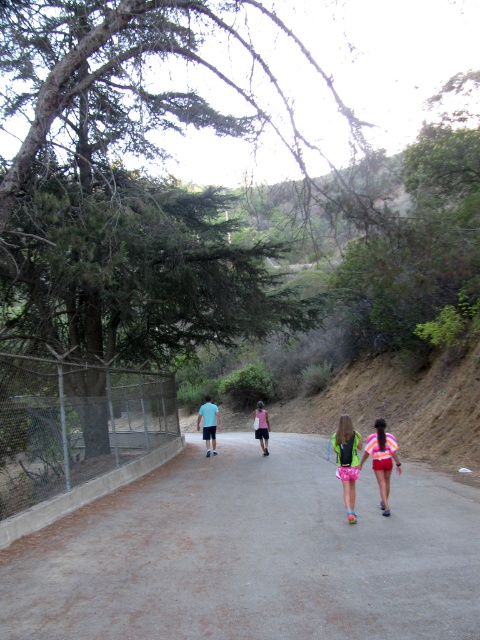
You are a delivery person carrying a package and need to cross the gray asphalt road at center while avoiding the pink fabric dress at center. How much distance do you need to cover to safely go around it?

The gray asphalt road at center and pink fabric dress at center are 7.48 meters apart. To safely go around the pink fabric dress at center, you need to cover a distance of at least 7.48 meters.

You are standing at the starting point of the paved pathway in the scene. There is a gray asphalt road at center marked by a point at coordinates [252,554]. If you walk straight ahead along the path, will you eventually reach the gray asphalt road at center?

Yes, since the gray asphalt road at center is represented by the point at coordinates [252,554], walking straight along the paved pathway will lead you to that location.